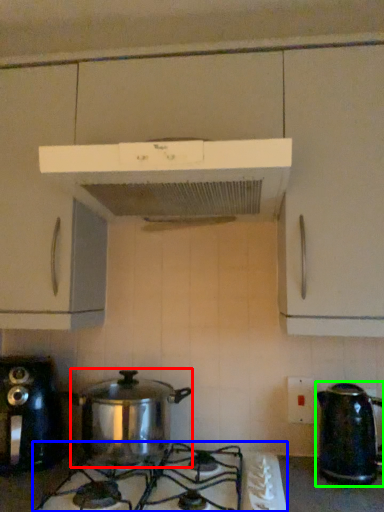
Question: Considering the real-world distances, which object is farthest from crock pot (highlighted by a red box)? gas stove (highlighted by a blue box) or kettle (highlighted by a green box)?

Choices:
 (A) gas stove
 (B) kettle

Answer: (B)